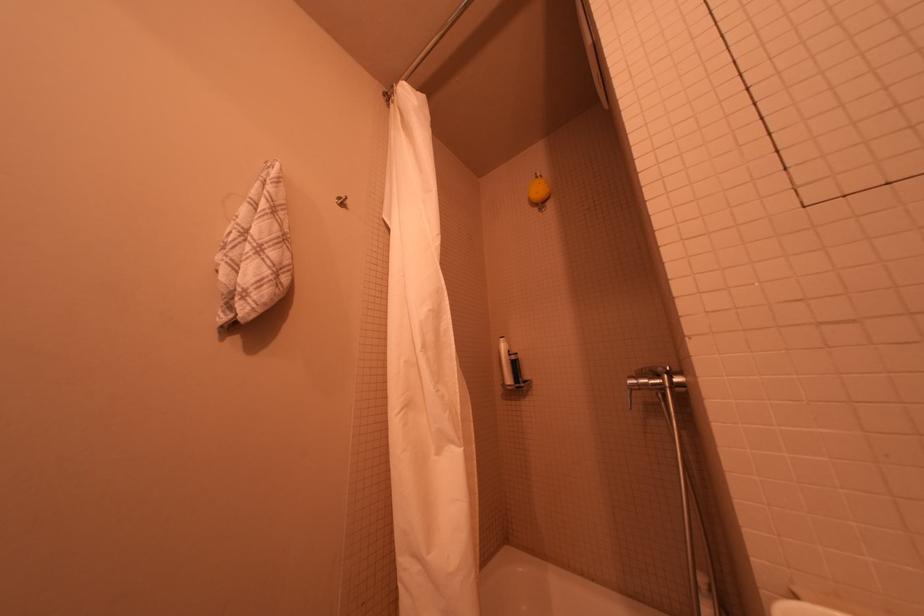
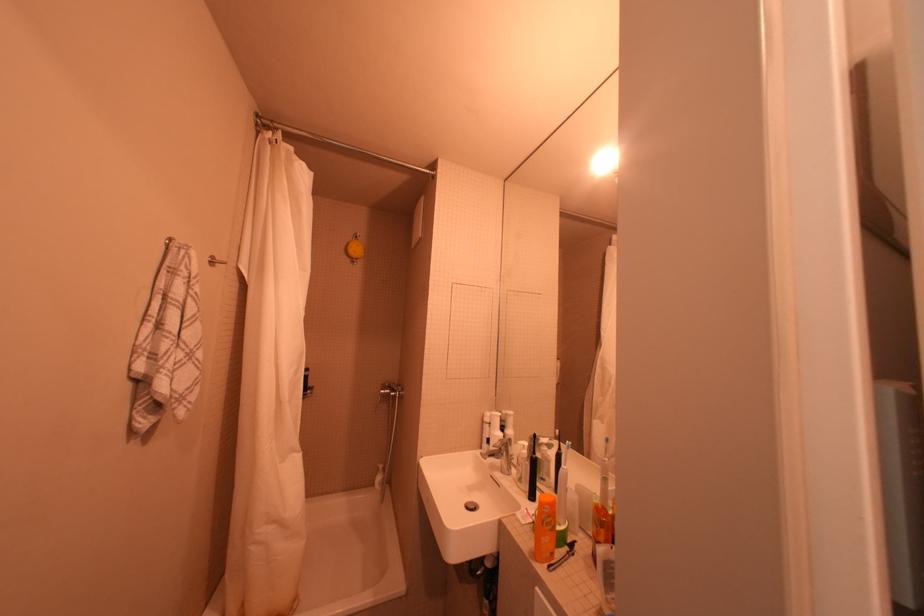
Locate, in the second image, the point that corresponds to point (666, 378) in the first image.

(402, 391)